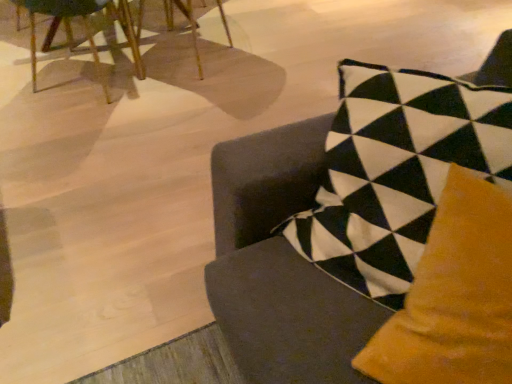
Question: Does wooden chair at upper left, positioned as the third chair in front-to-back order, have a lesser width compared to wooden chair at upper left, which is counted as the first chair, starting from the left?

Choices:
 (A) no
 (B) yes

Answer: (A)

Question: Is wooden chair at upper left, positioned as the third chair in front-to-back order, at the left side of wooden chair at upper left, acting as the second chair starting from the back?

Choices:
 (A) yes
 (B) no

Answer: (B)

Question: From a real-world perspective, is wooden chair at upper left, the 2th chair in the left-to-right sequence, physically above wooden chair at upper left, acting as the second chair starting from the back?

Choices:
 (A) yes
 (B) no

Answer: (B)

Question: Can you confirm if wooden chair at upper left, the 2th chair in the left-to-right sequence, is positioned to the right of wooden chair at upper left, acting as the second chair starting from the back?

Choices:
 (A) no
 (B) yes

Answer: (B)

Question: Is wooden chair at upper left, which is the third chair in right-to-left order, at the back of wooden chair at upper left, the 2th chair viewed from the right?

Choices:
 (A) yes
 (B) no

Answer: (B)

Question: Choose the correct answer: Is wooden chair at upper left, the 2th chair viewed from the right, inside wooden chair at upper left, acting as the second chair starting from the back, or outside it?

Choices:
 (A) outside
 (B) inside

Answer: (A)

Question: Considering the positions of wooden chair at upper left, which is the 1th chair from back to front, and wooden chair at upper left, which is counted as the first chair, starting from the left, in the image, is wooden chair at upper left, which is the 1th chair from back to front, taller or shorter than wooden chair at upper left, which is counted as the first chair, starting from the left,?

Choices:
 (A) short
 (B) tall

Answer: (A)

Question: Does point (138, 34) appear closer or farther from the camera than point (137, 56)?

Choices:
 (A) farther
 (B) closer

Answer: (B)

Question: From the image's perspective, relative to wooden chair at upper left, acting as the second chair starting from the back, is wooden chair at upper left, the 2th chair viewed from the right, above or below?

Choices:
 (A) below
 (B) above

Answer: (B)

Question: Looking at their shapes, would you say velvet cushion at center, marked as the first chair in a right-to-left arrangement, is wider or thinner than wooden chair at upper left, which is counted as the first chair, starting from the left?

Choices:
 (A) thin
 (B) wide

Answer: (A)

Question: Considering the positions of velvet cushion at center, which ranks as the 1th chair in front-to-back order, and wooden chair at upper left, placed as the second chair when sorted from front to back, in the image, is velvet cushion at center, which ranks as the 1th chair in front-to-back order, taller or shorter than wooden chair at upper left, placed as the second chair when sorted from front to back,?

Choices:
 (A) tall
 (B) short

Answer: (A)

Question: Considering the positions of point [259, 307] and point [93, 54], is point [259, 307] closer or farther from the camera than point [93, 54]?

Choices:
 (A) closer
 (B) farther

Answer: (A)

Question: From a real-world perspective, relative to wooden chair at upper left, which is counted as the first chair, starting from the left, is velvet cushion at center, marked as the first chair in a right-to-left arrangement, vertically above or below?

Choices:
 (A) below
 (B) above

Answer: (B)

Question: From the image's perspective, is velvet cushion at center, the 3th chair when ordered from back to front, above or below wooden chair at upper left, positioned as the third chair in front-to-back order?

Choices:
 (A) below
 (B) above

Answer: (A)

Question: Which is correct: velvet cushion at center, marked as the first chair in a right-to-left arrangement, is inside wooden chair at upper left, the 2th chair in the left-to-right sequence, or outside of it?

Choices:
 (A) inside
 (B) outside

Answer: (B)